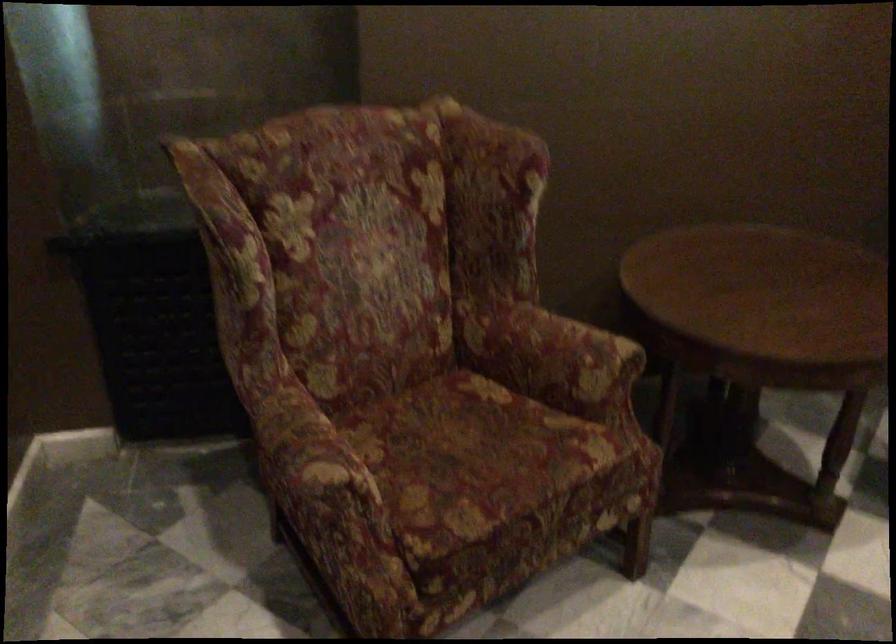
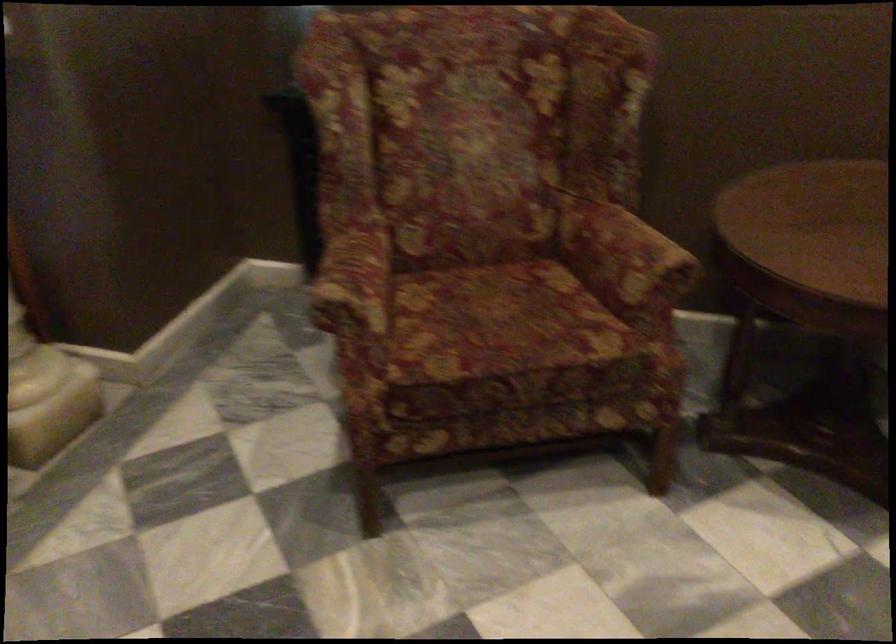
Question: The first image is from the beginning of the video and the second image is from the end. How did the camera likely rotate when shooting the video?

Choices:
 (A) Left
 (B) Right
 (C) Up
 (D) Down

Answer: (A)